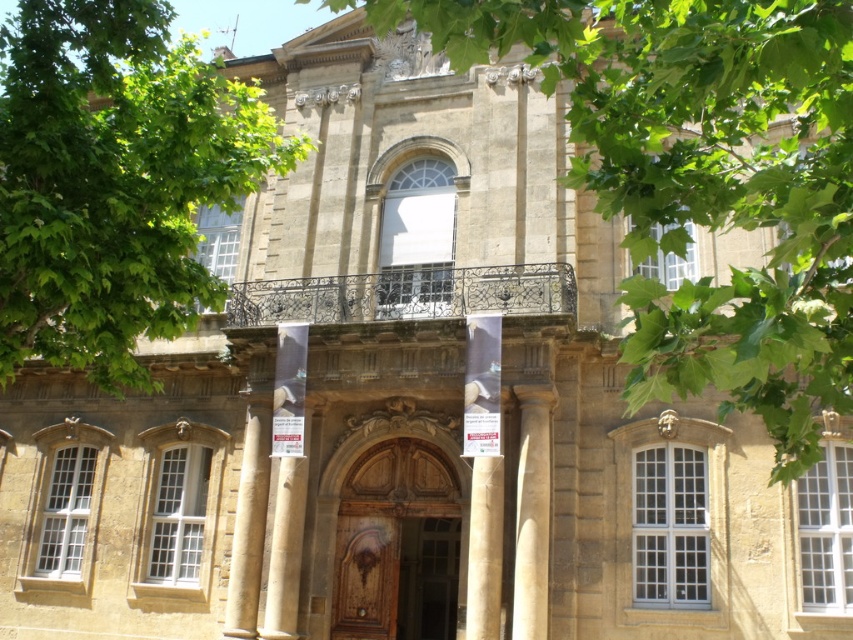
You are an architect analyzing the building layout. The green leafy tree at upper left and the smooth stone column at center are both visible from the front entrance. Which object would appear closer to the entrance based on their sizes?

The green leafy tree at upper left appears closer to the entrance because it has a larger size compared to the smooth stone column at center, indicating it is nearer according to the principle of perspective.